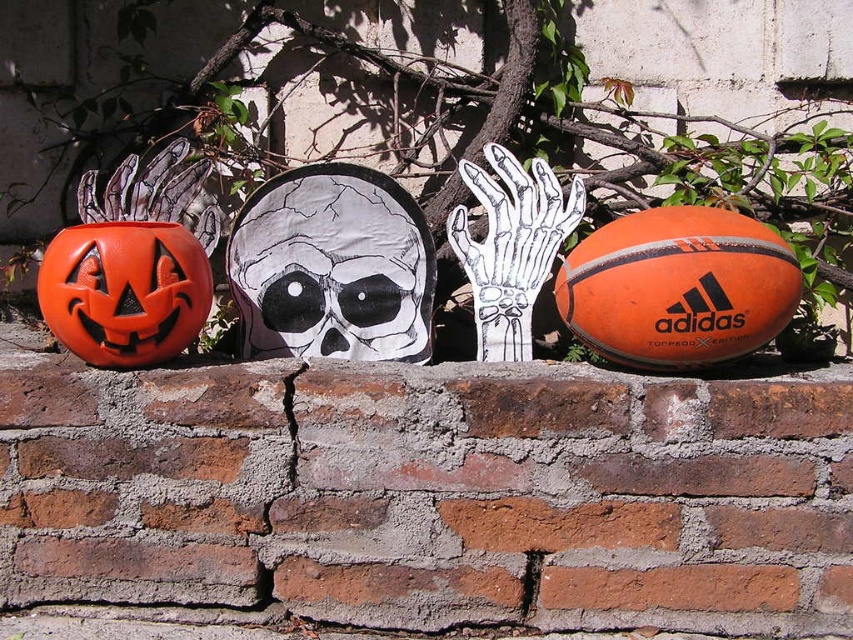
Question: Does black paper skull at center have a greater width compared to orange rubber basketball at right?

Choices:
 (A) yes
 (B) no

Answer: (A)

Question: Which point is farther to the camera?

Choices:
 (A) (695, 305)
 (B) (341, 228)
 (C) (186, 266)

Answer: (B)

Question: Among these points, which one is farthest from the camera?

Choices:
 (A) (138, 348)
 (B) (599, 298)
 (C) (393, 198)

Answer: (C)

Question: From the image, what is the correct spatial relationship of orange rubber basketball at right in relation to orange matte pumpkin at left?

Choices:
 (A) left
 (B) right

Answer: (B)

Question: Is the position of orange rubber basketball at right more distant than that of orange matte pumpkin at left?

Choices:
 (A) yes
 (B) no

Answer: (B)

Question: Considering the real-world distances, which object is closest to the black paper skull at center?

Choices:
 (A) orange matte pumpkin at left
 (B) orange rubber basketball at right

Answer: (A)